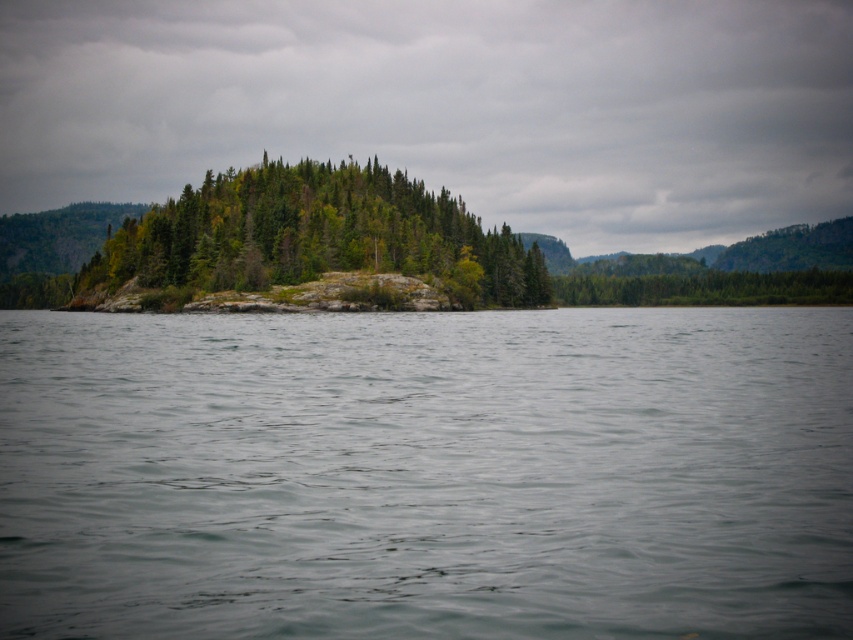
You are standing on the small island covered with greenery and looking at the point marked at coordinates (427,474). What is the location of this point relative to the gray water at center?

The point marked at coordinates (427,474) is located on the gray water at center according to the description.

You are standing at the origin point of the coordinate system in the scene. Where is the gray water at center located in terms of coordinates?

The gray water at center is located at coordinates point (427, 474).

You are a bird soaring above the landscape and want to land on the gray water at center or the green matte forest at center. Which surface is lower and thus safer for landing?

The gray water at center is shorter than the green matte forest at center, so it is lower and safer for landing.